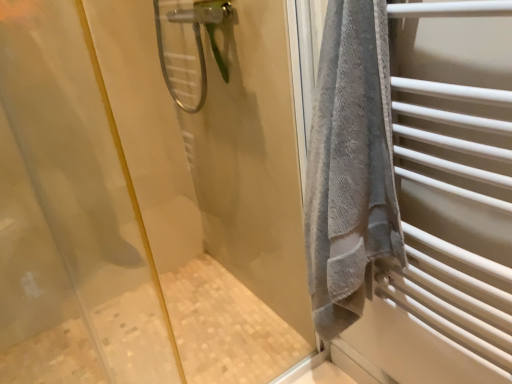
Question: Can you confirm if clear plastic shower head at upper center is positioned to the left of transparent glass shower door at upper left?

Choices:
 (A) no
 (B) yes

Answer: (B)

Question: Considering the relative sizes of clear plastic shower head at upper center and transparent glass shower door at upper left in the image provided, is clear plastic shower head at upper center taller than transparent glass shower door at upper left?

Choices:
 (A) yes
 (B) no

Answer: (B)

Question: Is transparent glass shower door at upper left surrounded by clear plastic shower head at upper center?

Choices:
 (A) no
 (B) yes

Answer: (A)

Question: From the image's perspective, is clear plastic shower head at upper center on top of transparent glass shower door at upper left?

Choices:
 (A) no
 (B) yes

Answer: (B)

Question: Is clear plastic shower head at upper center positioned before transparent glass shower door at upper left?

Choices:
 (A) yes
 (B) no

Answer: (B)

Question: From a real-world perspective, does clear plastic shower head at upper center sit lower than transparent glass shower door at upper left?

Choices:
 (A) yes
 (B) no

Answer: (B)

Question: Does transparent glass shower door at upper left turn towards clear plastic shower head at upper center?

Choices:
 (A) yes
 (B) no

Answer: (B)

Question: Is transparent glass shower door at upper left placed right next to clear plastic shower head at upper center?

Choices:
 (A) no
 (B) yes

Answer: (A)

Question: Is transparent glass shower door at upper left surrounding clear plastic shower head at upper center?

Choices:
 (A) yes
 (B) no

Answer: (B)

Question: From the image's perspective, would you say transparent glass shower door at upper left is shown under clear plastic shower head at upper center?

Choices:
 (A) no
 (B) yes

Answer: (B)

Question: Is the position of transparent glass shower door at upper left more distant than that of clear plastic shower head at upper center?

Choices:
 (A) yes
 (B) no

Answer: (B)

Question: Considering the relative sizes of transparent glass shower door at upper left and clear plastic shower head at upper center in the image provided, is transparent glass shower door at upper left shorter than clear plastic shower head at upper center?

Choices:
 (A) yes
 (B) no

Answer: (B)

Question: Is point pyautogui.click(x=173, y=89) positioned closer to the camera than point pyautogui.click(x=27, y=188)?

Choices:
 (A) closer
 (B) farther

Answer: (B)